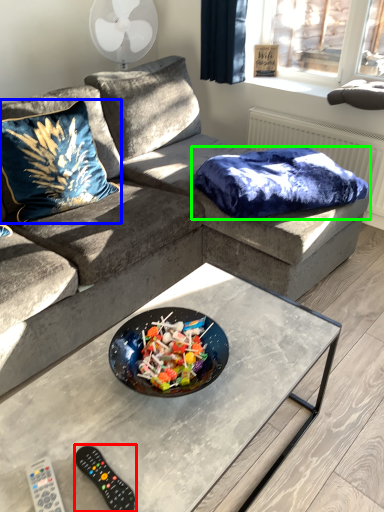
Question: Estimate the real-world distances between objects in this image. Which object is closer to remote (highlighted by a red box), throw pillow (highlighted by a blue box) or blanket (highlighted by a green box)?

Choices:
 (A) throw pillow
 (B) blanket

Answer: (A)